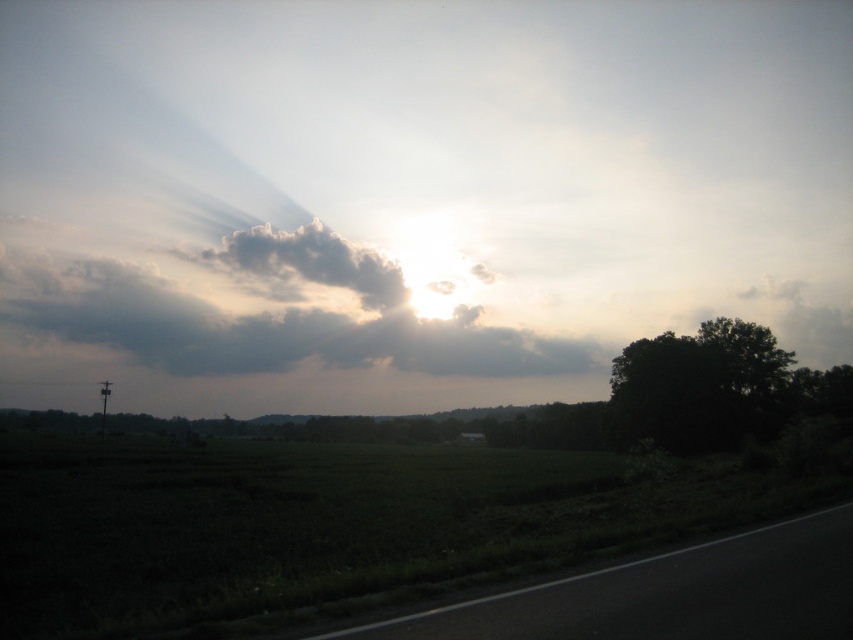
How much distance is there between black asphalt highway at lower right and cloudy gray at upper center?

They are 206.74 meters apart.

Can you confirm if black asphalt highway at lower right is positioned above cloudy gray at upper center?

No.

In order to click on black asphalt highway at lower right in this screenshot , I will do `click(668, 593)`.

Is dark gray cloud at upper center below cloudy gray at upper center?

Yes, dark gray cloud at upper center is below cloudy gray at upper center.

Can you confirm if dark gray cloud at upper center is bigger than cloudy gray at upper center?

Yes.

Does point (585, 369) come farther from viewer compared to point (271, 282)?

No, it is in front of (271, 282).

Find the location of a particular element. The height and width of the screenshot is (640, 853). dark gray cloud at upper center is located at coordinates (270, 312).

Is point (720, 588) positioned before point (712, 403)?

Yes, point (720, 588) is in front of point (712, 403).

Describe the element at coordinates (668, 593) in the screenshot. I see `black asphalt highway at lower right` at that location.

In order to click on black asphalt highway at lower right in this screenshot , I will do `click(668, 593)`.

This screenshot has width=853, height=640. In order to click on black asphalt highway at lower right in this screenshot , I will do [668, 593].